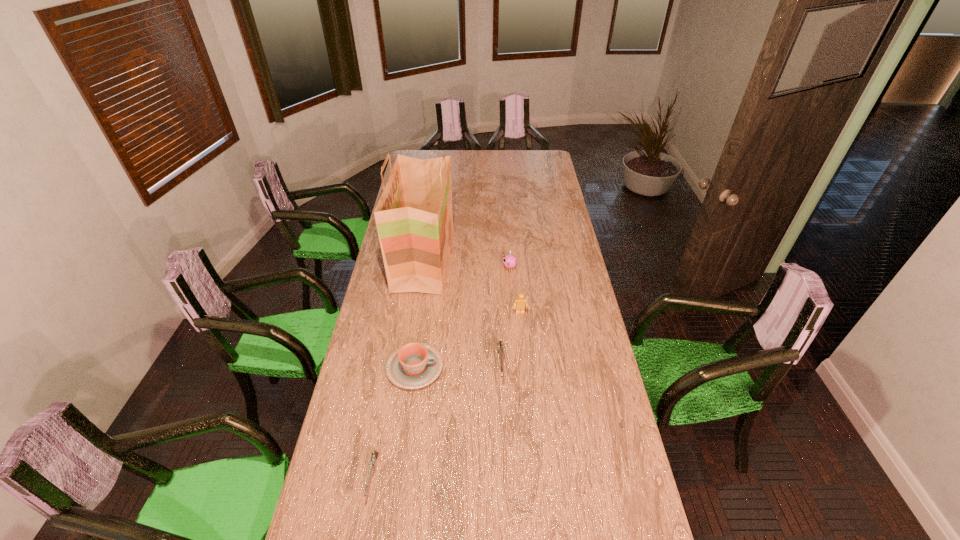
This screenshot has width=960, height=540. I want to click on the nearer pistol, so click(x=374, y=455).

In order to click on the left pistol in this screenshot , I will do `click(374, 455)`.

Find the location of a particular element. the third object from right to left is located at coordinates (500, 346).

Identify the location of the taller pistol. This screenshot has height=540, width=960. (500, 346).

Locate an element on the screen. This screenshot has height=540, width=960. cupcake is located at coordinates (509, 261).

The height and width of the screenshot is (540, 960). Find the location of `the tallest object`. the tallest object is located at coordinates (414, 216).

Find the location of a particular element. The width and height of the screenshot is (960, 540). the third farthest object is located at coordinates [520, 302].

At what (x,y) coordinates should I click in order to perform the action: click on chinaware. Please return your answer as a coordinate pair (x, y). Looking at the image, I should click on (415, 365).

The height and width of the screenshot is (540, 960). I want to click on free point located on the front-facing side of the taller pistol, so click(x=505, y=472).

You are a GUI agent. You are given a task and a screenshot of the screen. Output one action in this format:
    pyautogui.click(x=<x>, y=<y>)
    Task: Click on the free space located on the face of the cupcake
    The image size is (960, 540).
    Given the screenshot: What is the action you would take?
    pyautogui.click(x=440, y=268)